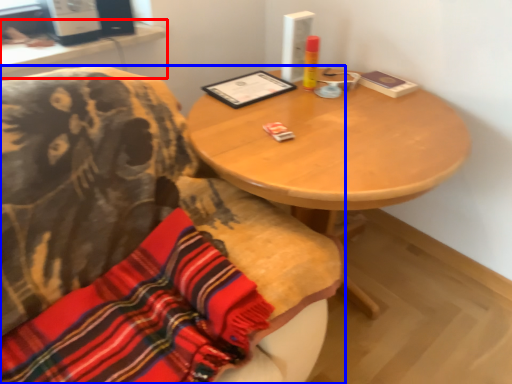
Question: Among these objects, which one is farthest to the camera, computer desk (highlighted by a red box) or chair (highlighted by a blue box)?

Choices:
 (A) computer desk
 (B) chair

Answer: (A)